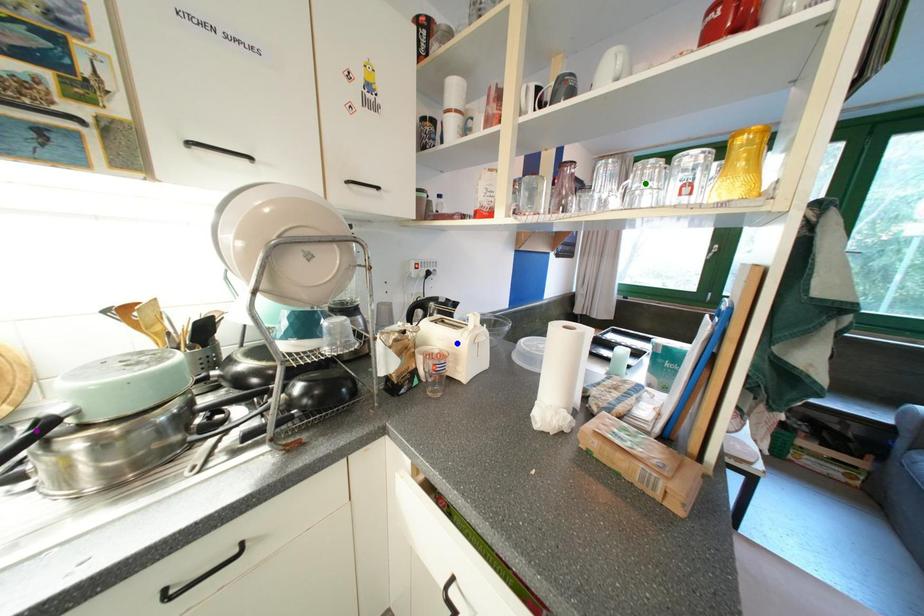
Order these from nearest to farthest:
1. purple point
2. blue point
3. green point

purple point
green point
blue point